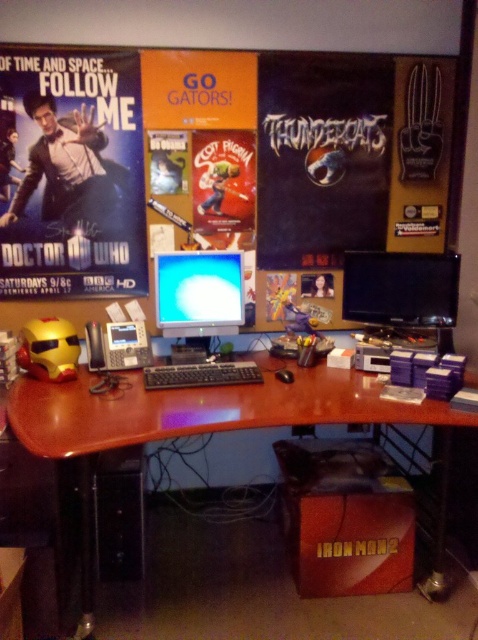
Describe the element at coordinates (74, 173) in the screenshot. The image size is (478, 640). I see `matte paper poster at upper left` at that location.

Who is lower down, matte paper poster at upper left or black glossy monitor at right?

black glossy monitor at right is below.

The height and width of the screenshot is (640, 478). I want to click on matte paper poster at upper left, so click(x=74, y=173).

Is point (24, 54) farther from viewer compared to point (177, 314)?

No.

Which of these two, matte paper poster at upper left or matte plastic monitor at center, stands shorter?

matte plastic monitor at center is shorter.

The height and width of the screenshot is (640, 478). Identify the location of matte paper poster at upper left. (74, 173).

Between point (173, 116) and point (178, 369), which one is positioned in front?

Positioned in front is point (178, 369).

Who is more distant from viewer, (330, 323) or (218, 362)?

Point (330, 323)

The height and width of the screenshot is (640, 478). Identify the location of wooden bulletin board at upper center. (325, 145).